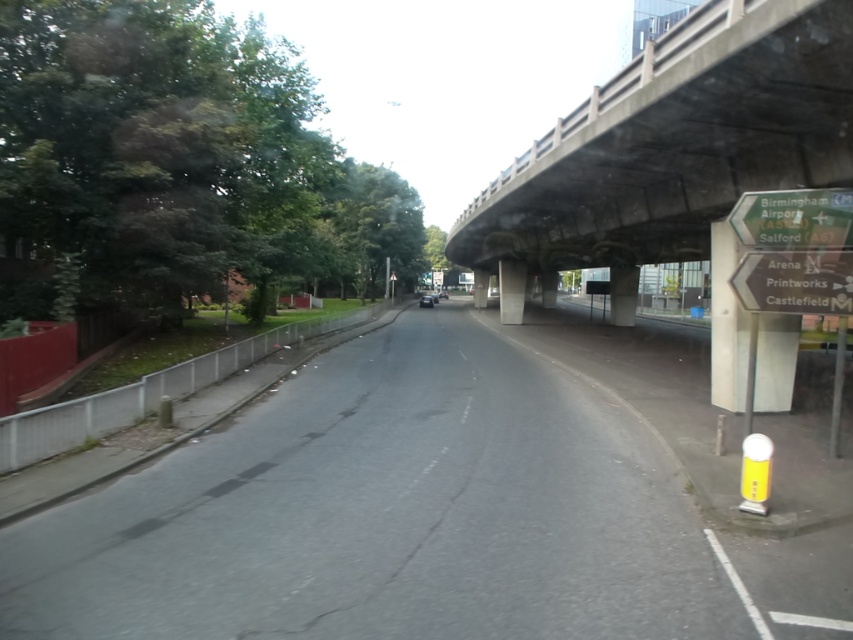
Question: Which of these objects is positioned closest to the green plastic sign at upper right?

Choices:
 (A) asphalt road at center
 (B) concrete at upper center

Answer: (A)

Question: Which point appears farthest from the camera in this image?

Choices:
 (A) (838, 65)
 (B) (752, 205)

Answer: (B)

Question: Observing the image, what is the correct spatial positioning of asphalt road at center in reference to green plastic sign at upper right?

Choices:
 (A) above
 (B) below

Answer: (B)

Question: Does asphalt road at center appear on the right side of concrete at upper center?

Choices:
 (A) no
 (B) yes

Answer: (A)

Question: Which object is closer to the camera taking this photo?

Choices:
 (A) green plastic sign at upper right
 (B) asphalt road at center
 (C) concrete at upper center

Answer: (B)

Question: In this image, where is asphalt road at center located relative to green plastic sign at upper right?

Choices:
 (A) left
 (B) right

Answer: (A)